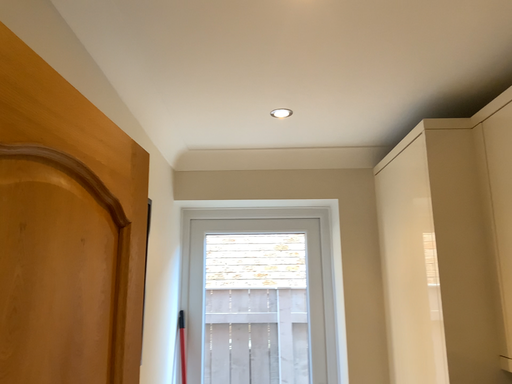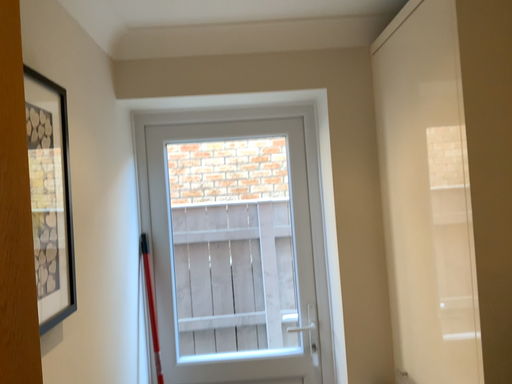
Question: Which way did the camera rotate in the video?

Choices:
 (A) rotated downward
 (B) rotated upward

Answer: (A)